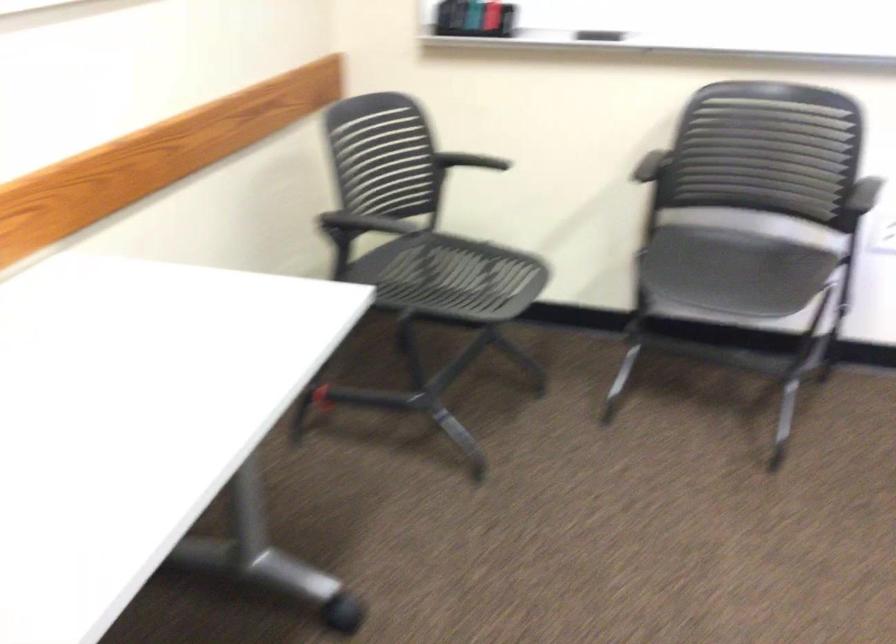
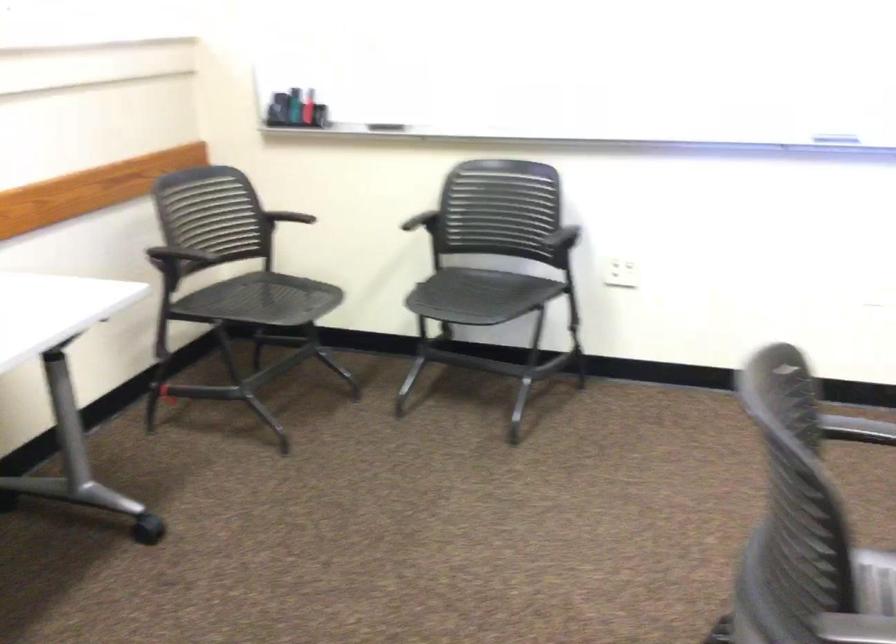
Find the pixel in the second image that matches [470,161] in the first image.

(291, 214)